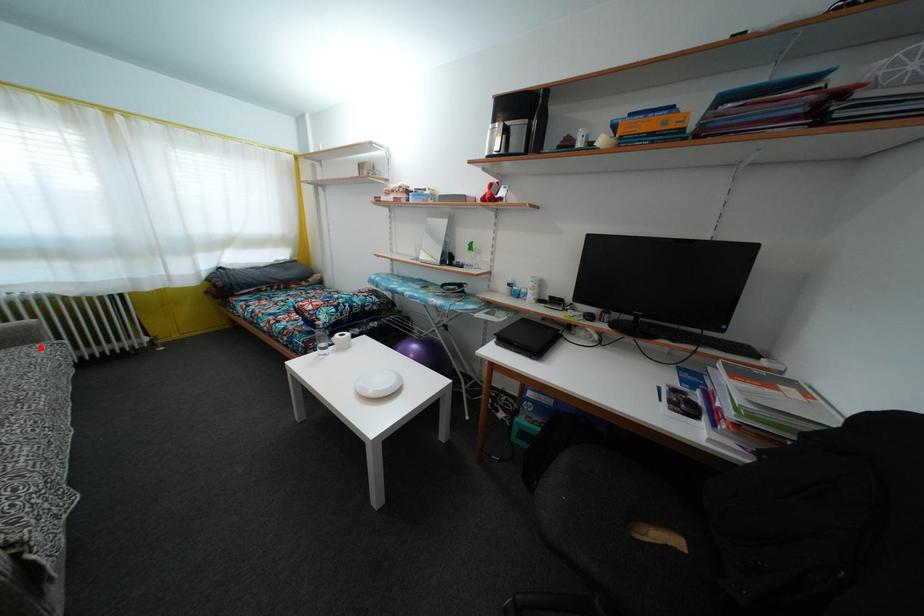
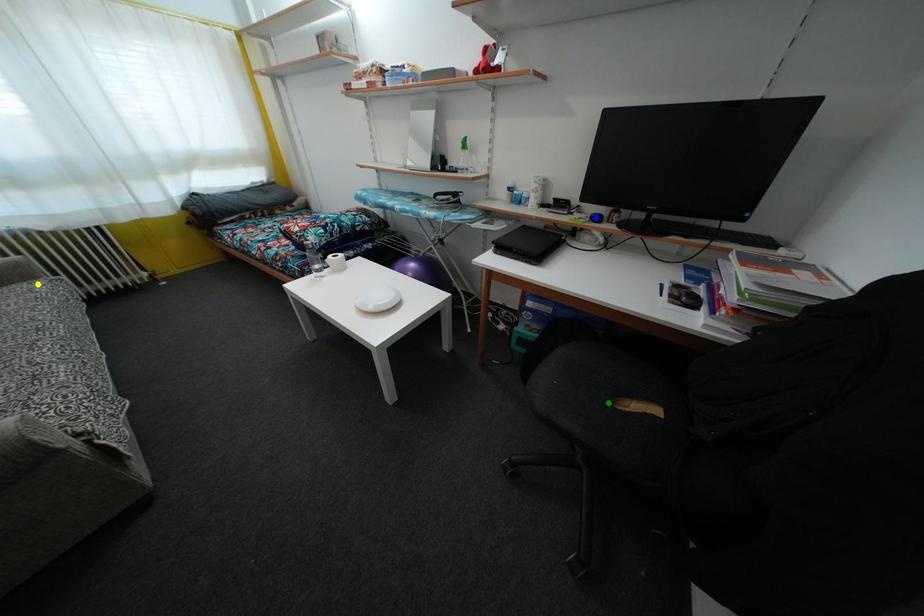
Question: I am providing you with two images of the same scene from different viewpoints. A red point is marked on the first image. You are given multiple points on the second image. Can you choose the point in image 2 that corresponds to the point in image 1?

Choices:
 (A) blue point
 (B) green point
 (C) yellow point

Answer: (C)